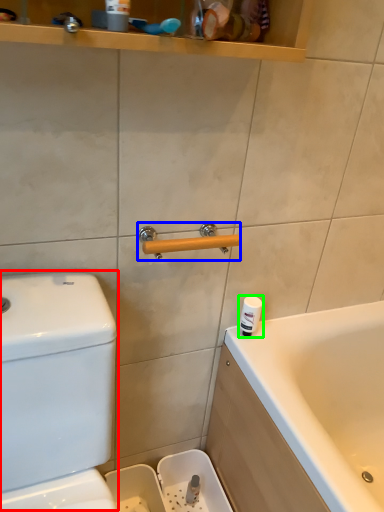
Question: Which object is the farthest from water tank (highlighted by a red box)? Choose among these: door handle (highlighted by a blue box) or toiletry (highlighted by a green box).

Choices:
 (A) door handle
 (B) toiletry

Answer: (B)